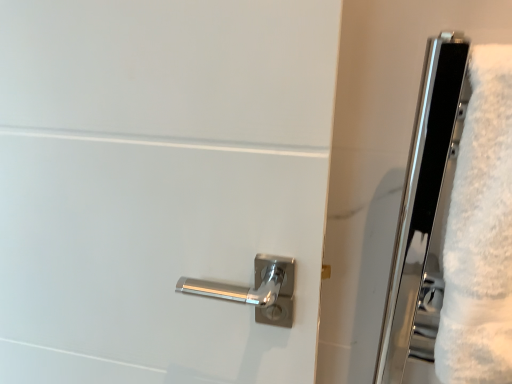
Question: Can you confirm if polished metal handle at center is wider than white fluffy bath towel at right?

Choices:
 (A) no
 (B) yes

Answer: (A)

Question: Is polished metal handle at center taller than white fluffy bath towel at right?

Choices:
 (A) no
 (B) yes

Answer: (B)

Question: From the image's perspective, would you say polished metal handle at center is shown under white fluffy bath towel at right?

Choices:
 (A) yes
 (B) no

Answer: (A)

Question: From a real-world perspective, is polished metal handle at center on top of white fluffy bath towel at right?

Choices:
 (A) no
 (B) yes

Answer: (A)

Question: From a real-world perspective, is polished metal handle at center physically below white fluffy bath towel at right?

Choices:
 (A) no
 (B) yes

Answer: (B)

Question: Is polished metal handle at center surrounding white fluffy bath towel at right?

Choices:
 (A) yes
 (B) no

Answer: (B)

Question: Considering the relative sizes of white fluffy bath towel at right and polished metal handle at center in the image provided, is white fluffy bath towel at right taller than polished metal handle at center?

Choices:
 (A) no
 (B) yes

Answer: (A)

Question: Does white fluffy bath towel at right come in front of polished metal handle at center?

Choices:
 (A) yes
 (B) no

Answer: (A)

Question: Can you confirm if white fluffy bath towel at right is shorter than polished metal handle at center?

Choices:
 (A) no
 (B) yes

Answer: (B)

Question: Is white fluffy bath towel at right turned away from polished metal handle at center?

Choices:
 (A) yes
 (B) no

Answer: (B)

Question: Is white fluffy bath towel at right to the left of polished metal handle at center from the viewer's perspective?

Choices:
 (A) yes
 (B) no

Answer: (B)

Question: Can you confirm if white fluffy bath towel at right is smaller than polished metal handle at center?

Choices:
 (A) no
 (B) yes

Answer: (B)

Question: Is polished metal handle at center bigger or smaller than white fluffy bath towel at right?

Choices:
 (A) big
 (B) small

Answer: (A)